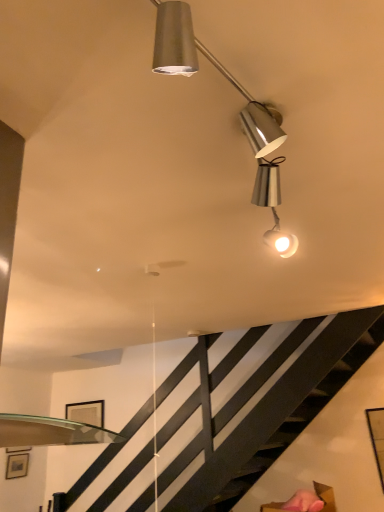
Question: Is matte black picture frame at lower left, the 2th picture frame in the back-to-front sequence, shorter than matte black picture frame at upper center, which is the 2th picture frame from left to right?

Choices:
 (A) yes
 (B) no

Answer: (A)

Question: Would you say matte black picture frame at lower left, the 2th picture frame in the back-to-front sequence, is outside matte black picture frame at upper center, which appears as the first picture frame when viewed from the back?

Choices:
 (A) no
 (B) yes

Answer: (B)

Question: Considering the relative positions of matte black picture frame at lower left, which is counted as the first picture frame, starting from the front, and matte black picture frame at upper center, which appears as the first picture frame when viewed from the back, in the image provided, is matte black picture frame at lower left, which is counted as the first picture frame, starting from the front, to the left of matte black picture frame at upper center, which appears as the first picture frame when viewed from the back, from the viewer's perspective?

Choices:
 (A) yes
 (B) no

Answer: (A)

Question: From the image's perspective, would you say matte black picture frame at lower left, acting as the second picture frame starting from the right, is shown under matte black picture frame at upper center, the first picture frame positioned from the right?

Choices:
 (A) no
 (B) yes

Answer: (B)

Question: Is the depth of matte black picture frame at lower left, arranged as the second picture frame when viewed from the top, less than that of matte black picture frame at upper center, the first picture frame positioned from the right?

Choices:
 (A) no
 (B) yes

Answer: (B)

Question: Does matte black picture frame at lower left, acting as the second picture frame starting from the right, have a greater height compared to matte black picture frame at upper center, which appears as the first picture frame when viewed from the back?

Choices:
 (A) no
 (B) yes

Answer: (A)

Question: Can matte black picture frame at upper center, the first picture frame viewed from the top, be found inside metallic silver lamp at upper center?

Choices:
 (A) yes
 (B) no

Answer: (B)

Question: Is metallic silver lamp at upper center wider than matte black picture frame at upper center, the first picture frame viewed from the top?

Choices:
 (A) yes
 (B) no

Answer: (A)

Question: Is metallic silver lamp at upper center not close to matte black picture frame at upper center, the first picture frame viewed from the top?

Choices:
 (A) no
 (B) yes

Answer: (B)

Question: From the image's perspective, is metallic silver lamp at upper center located above matte black picture frame at upper center, which appears as the first picture frame when viewed from the back?

Choices:
 (A) yes
 (B) no

Answer: (A)

Question: Is metallic silver lamp at upper center facing towards matte black picture frame at upper center, which is counted as the 2th picture frame, starting from the bottom?

Choices:
 (A) no
 (B) yes

Answer: (A)

Question: From a real-world perspective, is metallic silver lamp at upper center positioned under matte black picture frame at upper center, the first picture frame positioned from the right, based on gravity?

Choices:
 (A) yes
 (B) no

Answer: (B)

Question: Considering the relative sizes of matte black picture frame at upper center, the first picture frame viewed from the top, and metallic silver lamp at upper center in the image provided, is matte black picture frame at upper center, the first picture frame viewed from the top, bigger than metallic silver lamp at upper center?

Choices:
 (A) no
 (B) yes

Answer: (A)